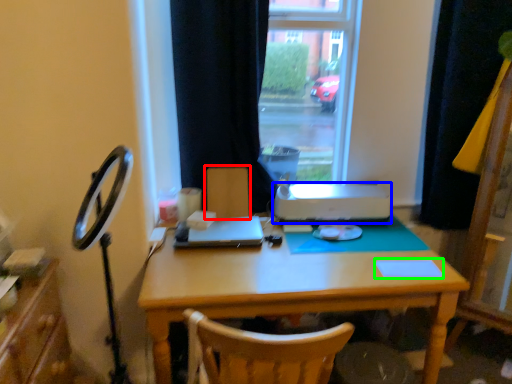
Question: Based on their relative distances, which object is nearer to armchair (highlighted by a red box)? Choose from printer (highlighted by a blue box) and notepad (highlighted by a green box).

Choices:
 (A) printer
 (B) notepad

Answer: (A)